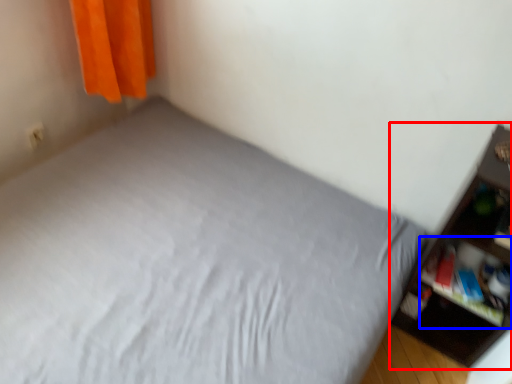
Question: Which of the following is the closest to the observer, shelf (highlighted by a red box) or cabinet (highlighted by a blue box)?

Choices:
 (A) shelf
 (B) cabinet

Answer: (A)